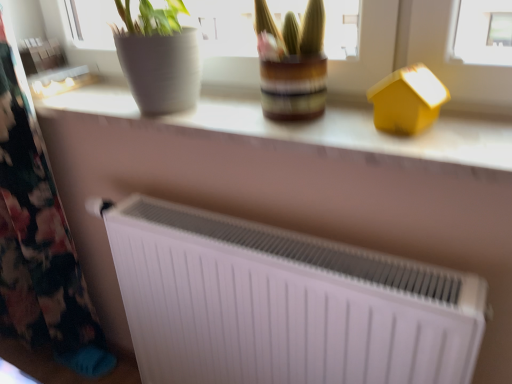
Question: From a real-world perspective, is white matte radiator at lower center on white matte radiator at center?

Choices:
 (A) no
 (B) yes

Answer: (A)

Question: Is white matte radiator at lower center at the right side of white matte radiator at center?

Choices:
 (A) yes
 (B) no

Answer: (A)

Question: Can you confirm if white matte radiator at lower center is bigger than white matte radiator at center?

Choices:
 (A) yes
 (B) no

Answer: (A)

Question: Does white matte radiator at lower center turn towards white matte radiator at center?

Choices:
 (A) no
 (B) yes

Answer: (A)

Question: Is white matte radiator at lower center taller than white matte radiator at center?

Choices:
 (A) no
 (B) yes

Answer: (B)

Question: From the image's perspective, would you say white matte radiator at lower center is positioned over white matte radiator at center?

Choices:
 (A) yes
 (B) no

Answer: (B)

Question: Does floral fabric at left have a larger size compared to matte white radiator at center?

Choices:
 (A) no
 (B) yes

Answer: (B)

Question: Is floral fabric at left taller than matte white radiator at center?

Choices:
 (A) no
 (B) yes

Answer: (B)

Question: Would you say floral fabric at left contains matte white radiator at center?

Choices:
 (A) yes
 (B) no

Answer: (B)

Question: Does floral fabric at left come in front of matte white radiator at center?

Choices:
 (A) no
 (B) yes

Answer: (A)

Question: From the image's perspective, is floral fabric at left on matte white radiator at center?

Choices:
 (A) yes
 (B) no

Answer: (B)

Question: Are floral fabric at left and matte white radiator at center beside each other?

Choices:
 (A) yes
 (B) no

Answer: (B)

Question: Is white matte radiator at center closer to the viewer compared to yellow matte house at upper right?

Choices:
 (A) no
 (B) yes

Answer: (B)